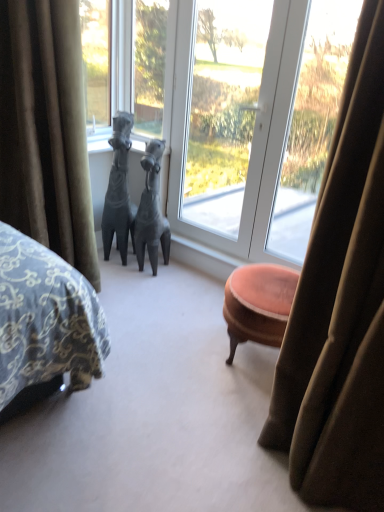
Question: Would you say matte gray horse at center, acting as the first animal starting from the right, is to the left or to the right of transparent glass window at center in the picture?

Choices:
 (A) left
 (B) right

Answer: (A)

Question: Is matte gray horse at center, acting as the first animal starting from the right, in front of or behind transparent glass window at center in the image?

Choices:
 (A) front
 (B) behind

Answer: (B)

Question: Which object is positioned farthest from the matte gray horse at center, acting as the first animal starting from the right?

Choices:
 (A) matte gray horse at center, placed as the 1th animal when sorted from left to right
 (B) transparent glass window at center
 (C) velvet green curtain at left
 (D) transparent glass window at center

Answer: (C)

Question: Which object is the farthest from the velvet green curtain at left?

Choices:
 (A) transparent glass window at center
 (B) transparent glass window at center
 (C) matte gray horse at center, which is counted as the second animal, starting from the left
 (D) matte gray horse at center, the 2th animal in the right-to-left sequence

Answer: (A)